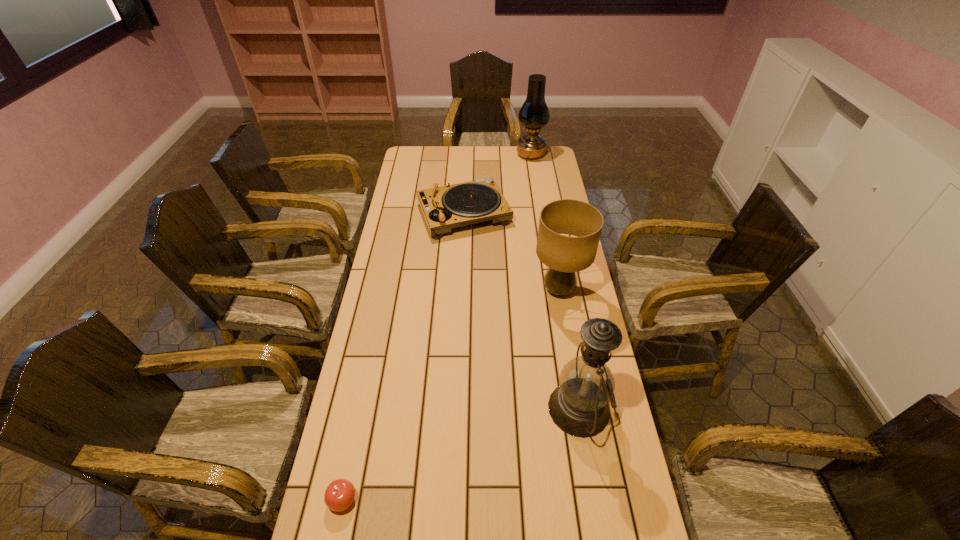
Identify the location of vacant area that lies between the fourth farthest object and the second object from left to right. The height and width of the screenshot is (540, 960). (521, 311).

At what (x,y) coordinates should I click in order to perform the action: click on free space between the shortest object and the nearer oil lamp. Please return your answer as a coordinate pair (x, y). Image resolution: width=960 pixels, height=540 pixels. Looking at the image, I should click on (461, 454).

Locate which object is the fourth closest to the farther oil lamp. Please provide its 2D coordinates. Your answer should be formatted as a tuple, i.e. [(x, y)], where the tuple contains the x and y coordinates of a point satisfying the conditions above.

[(339, 495)]

I want to click on object that can be found as the second closest to the third nearest object, so click(579, 406).

I want to click on free location that satisfies the following two spatial constraints: 1. on the front side of the nearer oil lamp; 2. on the right side of the farthest object, so click(x=571, y=408).

Where is `free point that satisfies the following two spatial constraints: 1. on the back side of the apple; 2. on the left side of the second farthest object`? free point that satisfies the following two spatial constraints: 1. on the back side of the apple; 2. on the left side of the second farthest object is located at coordinates (402, 214).

What are the coordinates of `free space that satisfies the following two spatial constraints: 1. on the back side of the lampshade; 2. on the left side of the second nearest object` in the screenshot? It's located at (559, 291).